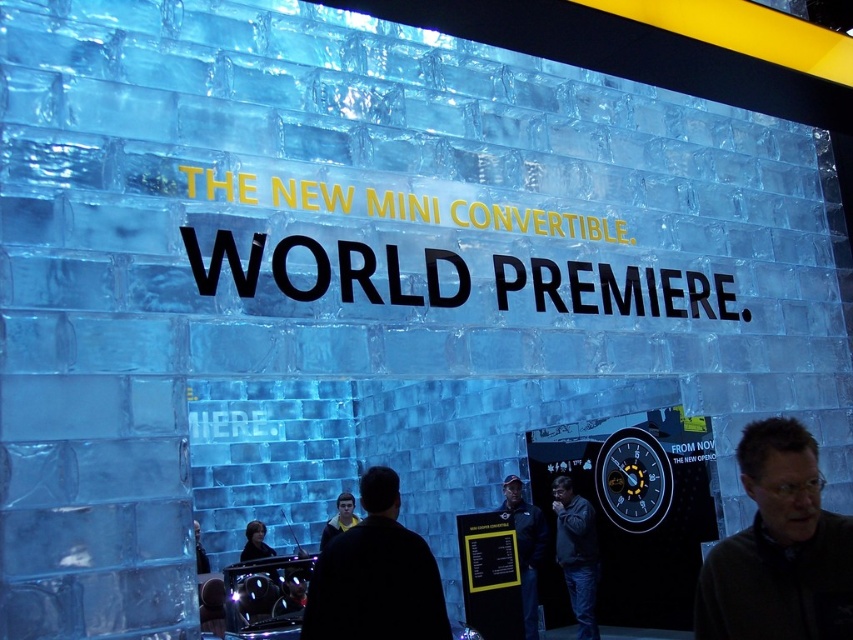
You are a photographer at the event and need to adjust the lighting to highlight both the dark gray sweater at center and the dark gray jacket at center. Since they are both dark gray, you want to ensure the camera can distinguish them. Based on their positions, which one is closer to the backdrop?

The dark gray sweater at center is located above the dark gray jacket at center, so the dark gray sweater at center is closer to the backdrop.

You are a photographer at the event and want to ensure both the black matte jacket at center and the dark blue jacket at center are fully visible in your photo. Which jacket should you focus on to avoid cropping the top of the taller one?

The dark blue jacket at center is taller than the black matte jacket at center, so you should focus on ensuring the dark blue jacket at center is fully visible to avoid cropping the top.